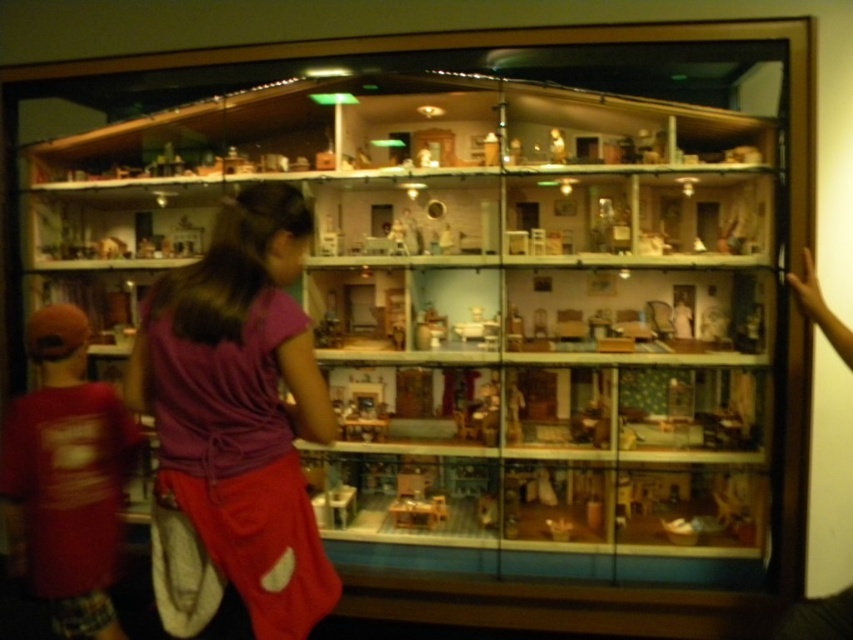
Question: From the image, what is the correct spatial relationship of purple fabric skirt at center in relation to matte red shirt at left?

Choices:
 (A) left
 (B) right

Answer: (B)

Question: Is purple fabric skirt at center wider than matte red shirt at left?

Choices:
 (A) yes
 (B) no

Answer: (A)

Question: Is purple fabric skirt at center wider than matte red shirt at left?

Choices:
 (A) yes
 (B) no

Answer: (A)

Question: Which point is farther from the camera taking this photo?

Choices:
 (A) (138, 364)
 (B) (27, 513)

Answer: (B)

Question: Which point is farther to the camera?

Choices:
 (A) (287, 516)
 (B) (120, 433)

Answer: (B)